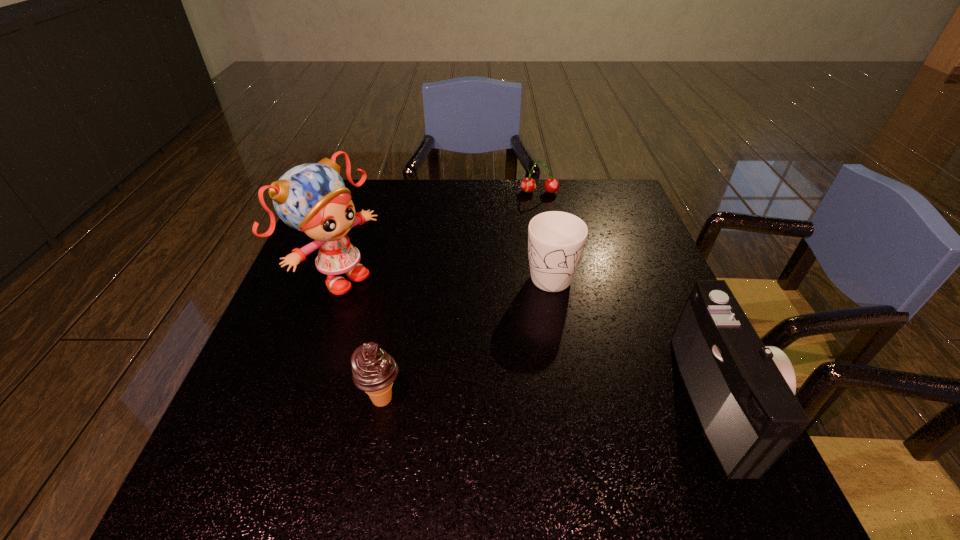
Where is `object situated at the left edge`? object situated at the left edge is located at coordinates (312, 198).

Image resolution: width=960 pixels, height=540 pixels. What are the coordinates of `object that is at the right edge` in the screenshot? It's located at (743, 393).

Identify the location of object at the near right corner. (743, 393).

At what (x,y) coordinates should I click in order to perform the action: click on vacant region at the far edge of the desktop. Please return your answer as a coordinate pair (x, y). The image size is (960, 540). Looking at the image, I should click on click(x=581, y=211).

The image size is (960, 540). What are the coordinates of `vacant space at the near edge` in the screenshot? It's located at (438, 424).

You are a GUI agent. You are given a task and a screenshot of the screen. Output one action in this format:
    pyautogui.click(x=<x>, y=<y>)
    Task: Click on the vacant region at the left edge of the desktop
    This screenshot has width=960, height=540.
    Given the screenshot: What is the action you would take?
    pyautogui.click(x=290, y=285)

You are a GUI agent. You are given a task and a screenshot of the screen. Output one action in this format:
    pyautogui.click(x=<x>, y=<y>)
    Task: Click on the vacant space at the right edge
    The image size is (960, 540).
    Given the screenshot: What is the action you would take?
    pyautogui.click(x=636, y=241)

This screenshot has height=540, width=960. I want to click on vacant area at the far left corner of the desktop, so click(378, 180).

At what (x,y) coordinates should I click in order to perform the action: click on vacant point at the near left corner. Please return your answer as a coordinate pair (x, y). Looking at the image, I should click on (288, 444).

Where is `vacant space at the far right corner of the desktop`? vacant space at the far right corner of the desktop is located at coordinates (632, 208).